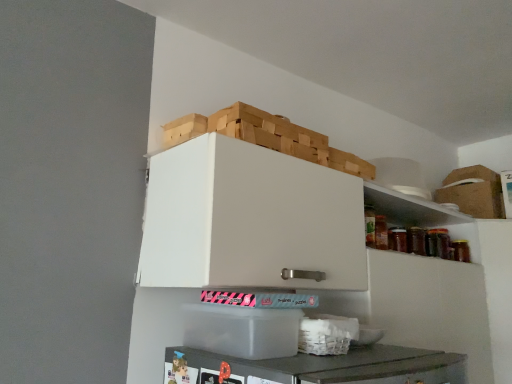
Question: Is brown cardboard box at upper right, which is the second cardboard box from left to right, bigger or smaller than white woven basket at lower center?

Choices:
 (A) small
 (B) big

Answer: (B)

Question: From their relative heights in the image, would you say brown cardboard box at upper right, which appears as the 2th cardboard box when ordered from the bottom, is taller or shorter than white woven basket at lower center?

Choices:
 (A) short
 (B) tall

Answer: (B)

Question: Which is farther from the white woven basket at lower center?

Choices:
 (A) brown cardboard box at upper right, the 2th cardboard box in the front-to-back sequence
 (B) wooden crate at upper center
 (C) transparent plastic container at lower center, the first cardboard box when ordered from front to back

Answer: (A)

Question: Which is farther from the transparent plastic container at lower center, which is counted as the first cardboard box, starting from the left?

Choices:
 (A) wooden crate at upper center
 (B) brown cardboard box at upper right, which appears as the 2th cardboard box when ordered from the bottom
 (C) white woven basket at lower center

Answer: (B)